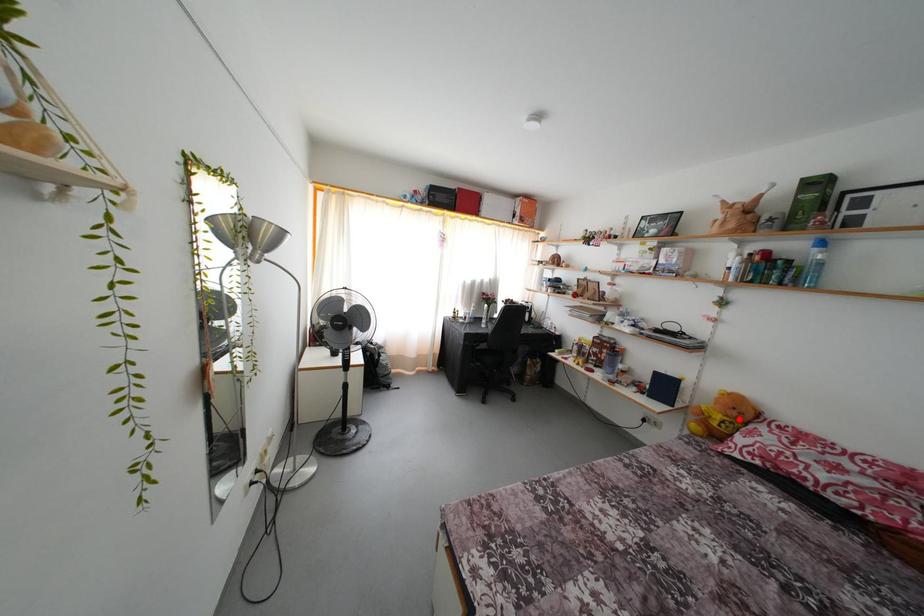
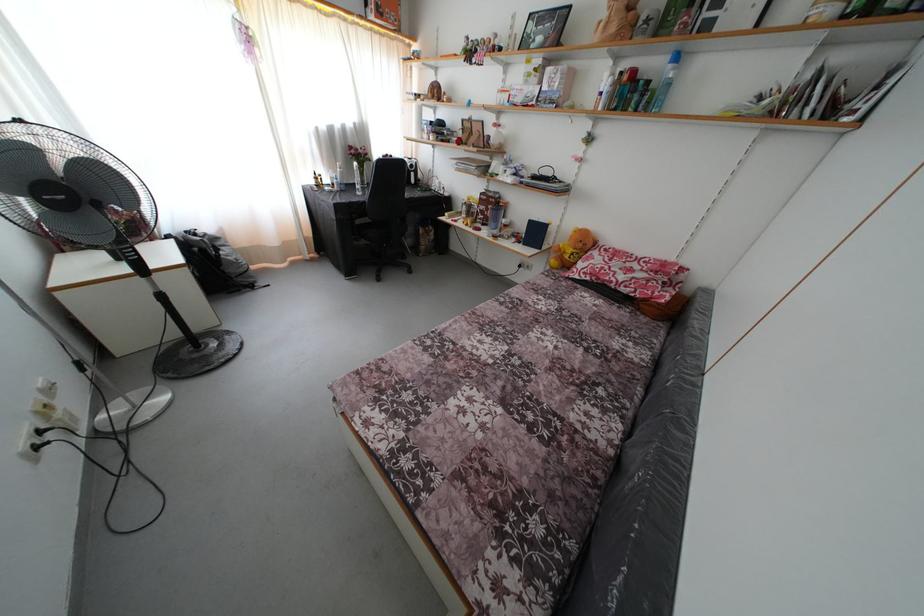
Question: I am providing you with two images of the same scene from different viewpoints. In image1, a red point is highlighted. Considering the same 3D point in image2, which of the following is correct?

Choices:
 (A) It is closer
 (B) It is farther

Answer: (A)